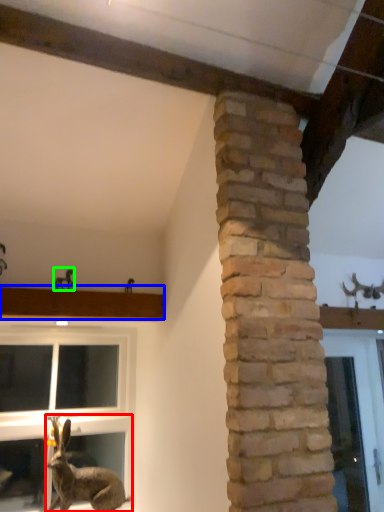
Question: Which object is positioned closest to rabbit (highlighted by a red box)? Select from window sill (highlighted by a blue box) and animal (highlighted by a green box).

Choices:
 (A) window sill
 (B) animal

Answer: (A)